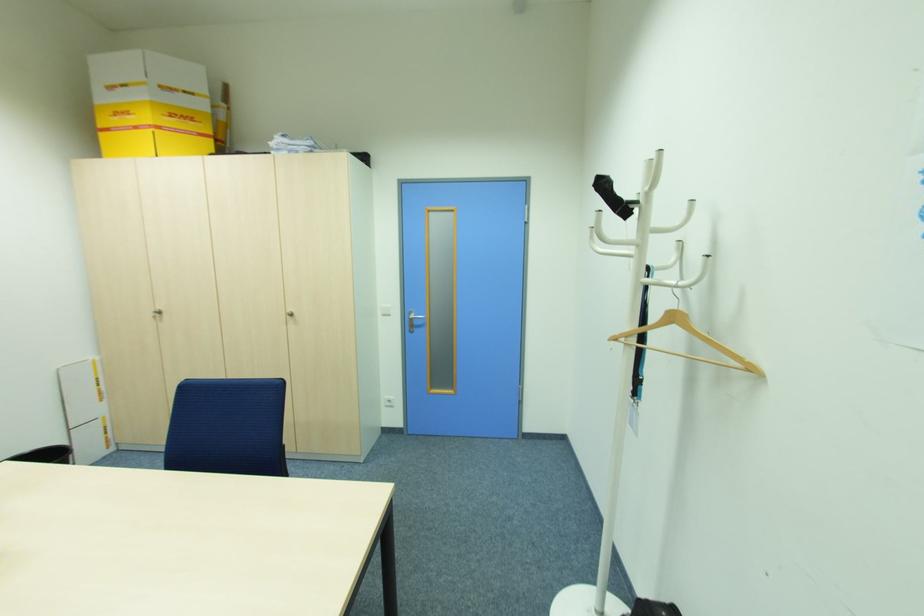
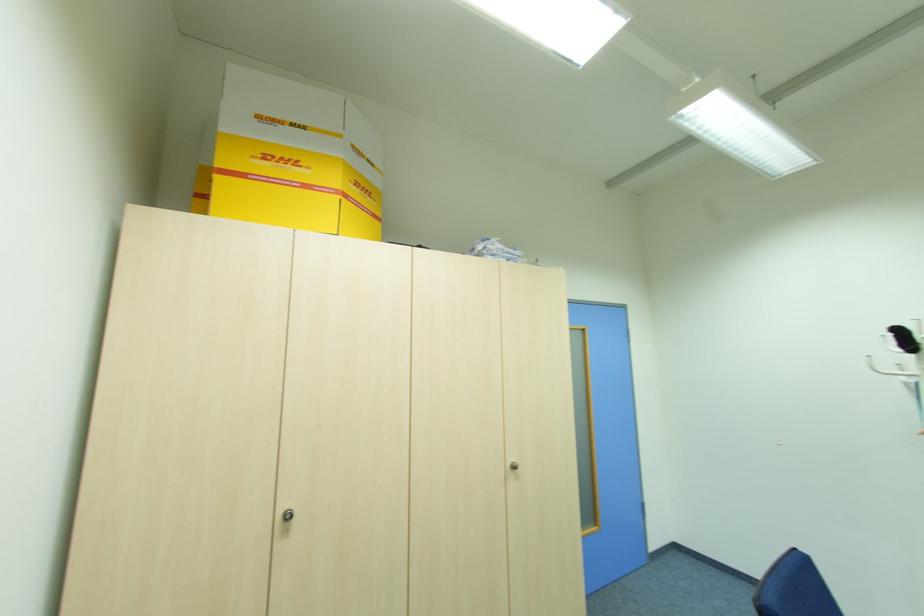
In the second image, find the point that corresponds to (292,310) in the first image.

(513, 460)